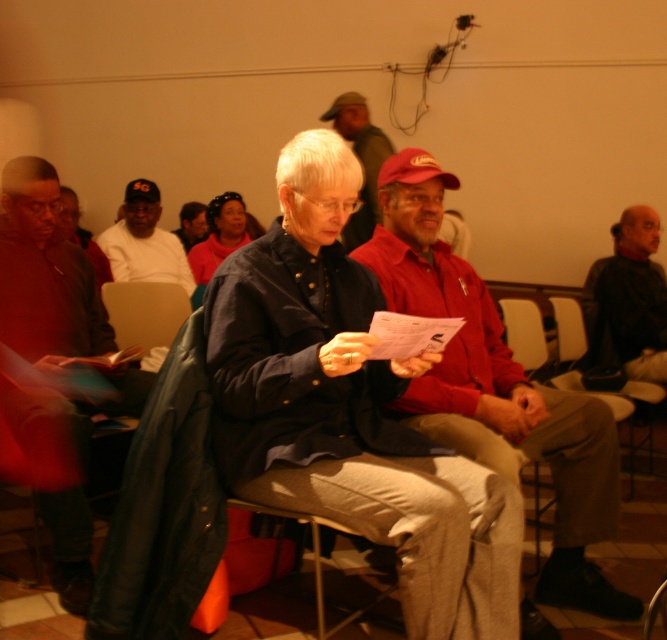
You are standing in the room where the meeting is taking place. You notice two points marked in the scene. The first point is at coordinates point (x=500, y=371) and the second point is at point (x=95, y=352). Which of these two points is physically closer to your current position in the room?

Point (x=500, y=371) is closer to the viewer than point (x=95, y=352), so the first point is closer to your current position in the room.

You are a person who is 5 feet tall and want to sit in the light brown fabric chair at center. The dark brown leather jacket at left is blocking your path. Can you walk around it?

The dark brown leather jacket at left is 5.92 feet from the light brown fabric chair at center. Since you are 5 feet tall, you can easily walk around the jacket as the distance between them is sufficient to maneuver around the jacket without any issues.

You are organizing a clothing donation drive and need to determine if the red cotton shirt at center and the gray fabric jacket at left can fit into a standard donation box that can hold items up to 20 inches in length. Given their sizes, can both items fit comfortably in the box?

The red cotton shirt at center is larger than the gray fabric jacket at left. Since the donation box can hold items up to 20 inches in length, both items should fit comfortably as long as each is within the size limit individually. However, the exact fit depends on their individual dimensions, which are not provided here.